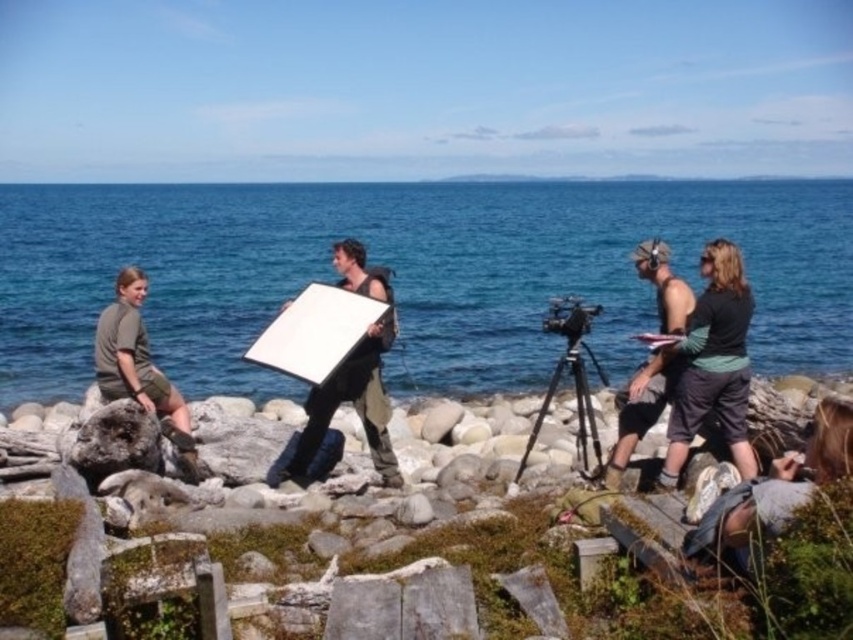
You are a photographer planning to capture a wide shot of the scene. Considering the blue water at center and the green cotton shirt at left, which object would occupy more space in the final photo?

The blue water at center occupies more space in the photo since it is larger in size than the green cotton shirt at left.